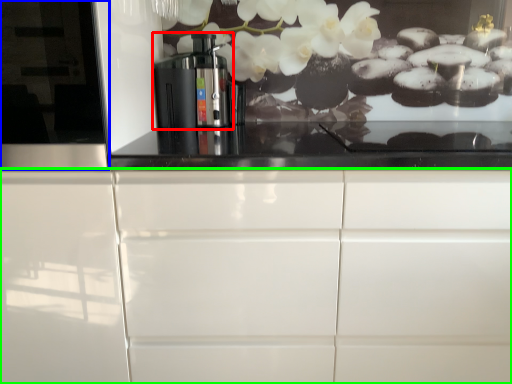
Question: Estimate the real-world distances between objects in this image. Which object is farther from home appliance (highlighted by a red box), glass door (highlighted by a blue box) or cabinetry (highlighted by a green box)?

Choices:
 (A) glass door
 (B) cabinetry

Answer: (B)